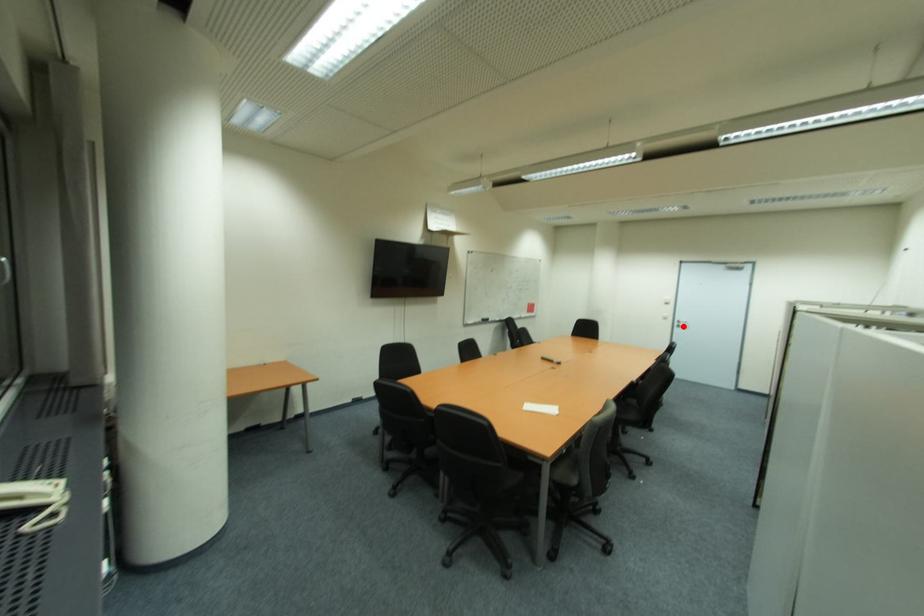
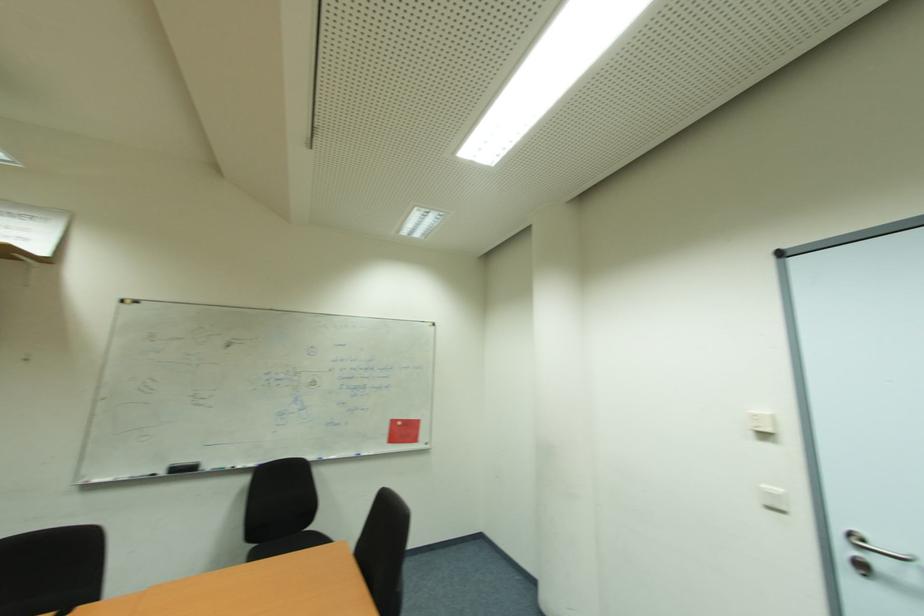
Where in the second image is the point corresponding to the highlighted location from the first image?

(869, 570)